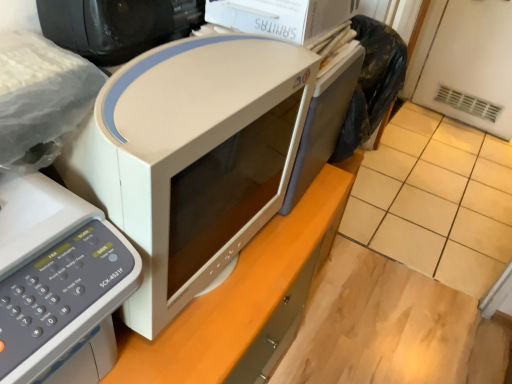
Question: Is white matte microwave at left, the second home appliance when ordered from right to left, oriented away from beige tile at center?

Choices:
 (A) yes
 (B) no

Answer: (B)

Question: Considering the relative positions of white matte microwave at left, the second home appliance when ordered from right to left, and beige tile at center in the image provided, is white matte microwave at left, the second home appliance when ordered from right to left, behind beige tile at center?

Choices:
 (A) no
 (B) yes

Answer: (A)

Question: From the image's perspective, does white matte microwave at left, the first home appliance positioned from the left, appear lower than beige tile at center?

Choices:
 (A) no
 (B) yes

Answer: (B)

Question: Considering the relative sizes of white matte microwave at left, the second home appliance when ordered from right to left, and beige tile at center in the image provided, is white matte microwave at left, the second home appliance when ordered from right to left, taller than beige tile at center?

Choices:
 (A) yes
 (B) no

Answer: (A)

Question: Considering the relative sizes of white matte microwave at left, the first home appliance positioned from the left, and beige tile at center in the image provided, is white matte microwave at left, the first home appliance positioned from the left, bigger than beige tile at center?

Choices:
 (A) yes
 (B) no

Answer: (B)

Question: Relative to black glossy desktop computer at upper left, is white matte computer desk at center in front or behind?

Choices:
 (A) front
 (B) behind

Answer: (B)

Question: Considering the positions of white matte computer desk at center and black glossy desktop computer at upper left in the image, is white matte computer desk at center wider or thinner than black glossy desktop computer at upper left?

Choices:
 (A) thin
 (B) wide

Answer: (B)

Question: From the image's perspective, relative to black glossy desktop computer at upper left, is white matte computer desk at center above or below?

Choices:
 (A) below
 (B) above

Answer: (A)

Question: Is point (224, 299) positioned closer to the camera than point (175, 23)?

Choices:
 (A) farther
 (B) closer

Answer: (A)

Question: Relative to white matte microwave at center, the first home appliance from the right, is beige tile at center in front or behind?

Choices:
 (A) behind
 (B) front

Answer: (A)

Question: Looking at their shapes, would you say beige tile at center is wider or thinner than white matte microwave at center, the first home appliance from the right?

Choices:
 (A) wide
 (B) thin

Answer: (A)

Question: From the image's perspective, relative to white matte microwave at center, the first home appliance from the right, is beige tile at center above or below?

Choices:
 (A) above
 (B) below

Answer: (A)

Question: From a real-world perspective, is beige tile at center physically located above or below white matte microwave at center, the first home appliance from the right?

Choices:
 (A) above
 (B) below

Answer: (B)

Question: Is point (80, 24) closer or farther from the camera than point (462, 231)?

Choices:
 (A) farther
 (B) closer

Answer: (B)

Question: Is black glossy desktop computer at upper left inside or outside of beige tile at center?

Choices:
 (A) inside
 (B) outside

Answer: (B)